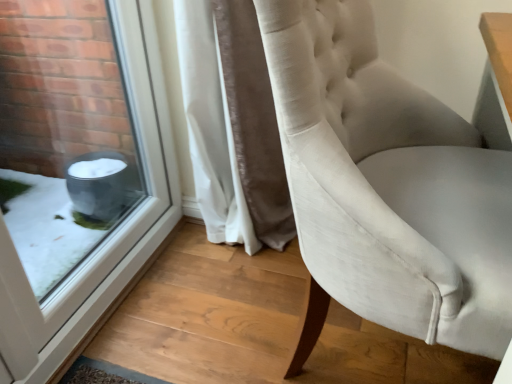
Question: Is satin white chair at center at the back of white velvet curtain at center?

Choices:
 (A) no
 (B) yes

Answer: (A)

Question: Is white velvet curtain at center taller than satin white chair at center?

Choices:
 (A) no
 (B) yes

Answer: (A)

Question: Is white velvet curtain at center to the right of satin white chair at center from the viewer's perspective?

Choices:
 (A) no
 (B) yes

Answer: (A)

Question: Is there a large distance between white velvet curtain at center and satin white chair at center?

Choices:
 (A) yes
 (B) no

Answer: (B)

Question: Considering the relative sizes of white velvet curtain at center and satin white chair at center in the image provided, is white velvet curtain at center bigger than satin white chair at center?

Choices:
 (A) no
 (B) yes

Answer: (A)

Question: Does white velvet curtain at center come behind satin white chair at center?

Choices:
 (A) yes
 (B) no

Answer: (A)

Question: Does satin white chair at center have a larger size compared to transparent glass window at lower left?

Choices:
 (A) no
 (B) yes

Answer: (B)

Question: Is there a large distance between satin white chair at center and transparent glass window at lower left?

Choices:
 (A) yes
 (B) no

Answer: (B)

Question: Is satin white chair at center not inside transparent glass window at lower left?

Choices:
 (A) yes
 (B) no

Answer: (A)

Question: Could you tell me if satin white chair at center is turned towards transparent glass window at lower left?

Choices:
 (A) no
 (B) yes

Answer: (A)

Question: From a real-world perspective, is satin white chair at center over transparent glass window at lower left?

Choices:
 (A) yes
 (B) no

Answer: (B)

Question: Considering the relative positions of satin white chair at center and transparent glass window at lower left in the image provided, is satin white chair at center to the left of transparent glass window at lower left from the viewer's perspective?

Choices:
 (A) no
 (B) yes

Answer: (A)

Question: From a real-world perspective, is transparent glass window at lower left physically above white velvet curtain at center?

Choices:
 (A) no
 (B) yes

Answer: (B)